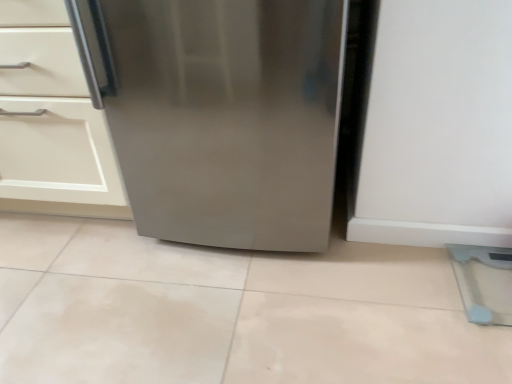
The height and width of the screenshot is (384, 512). What do you see at coordinates (52, 121) in the screenshot?
I see `matte white cabinet at left` at bounding box center [52, 121].

Locate an element on the screen. matte white cabinet at left is located at coordinates (52, 121).

What is the approximate height of stainless steel refrigerator at center?

28.58 inches.

Identify the location of stainless steel refrigerator at center. The image size is (512, 384). (221, 114).

Image resolution: width=512 pixels, height=384 pixels. What do you see at coordinates (221, 114) in the screenshot?
I see `stainless steel refrigerator at center` at bounding box center [221, 114].

The image size is (512, 384). Identify the location of matte white cabinet at left. (52, 121).

Does matte white cabinet at left appear on the right side of stainless steel refrigerator at center?

No, matte white cabinet at left is not to the right of stainless steel refrigerator at center.

Between matte white cabinet at left and stainless steel refrigerator at center, which one is positioned behind?

matte white cabinet at left is behind.

Is point (31, 39) behind point (189, 106)?

Yes.

From the image's perspective, would you say matte white cabinet at left is shown under stainless steel refrigerator at center?

Incorrect, from the image's perspective, matte white cabinet at left is higher than stainless steel refrigerator at center.

From a real-world perspective, is matte white cabinet at left positioned under stainless steel refrigerator at center based on gravity?

Yes, from a real-world perspective, matte white cabinet at left is below stainless steel refrigerator at center.

Looking at this image, is matte white cabinet at left wider than stainless steel refrigerator at center?

In fact, matte white cabinet at left might be narrower than stainless steel refrigerator at center.

From the picture: Considering the relative sizes of matte white cabinet at left and stainless steel refrigerator at center in the image provided, is matte white cabinet at left shorter than stainless steel refrigerator at center?

Yes, matte white cabinet at left is shorter than stainless steel refrigerator at center.

Between matte white cabinet at left and stainless steel refrigerator at center, which one has larger size?

matte white cabinet at left.

Is matte white cabinet at left inside or outside of stainless steel refrigerator at center?

matte white cabinet at left is outside stainless steel refrigerator at center.

Is the surface of matte white cabinet at left in direct contact with stainless steel refrigerator at center?

No.

Is matte white cabinet at left turned away from stainless steel refrigerator at center?

No, matte white cabinet at left's orientation is not away from stainless steel refrigerator at center.

Can you tell me how much matte white cabinet at left and stainless steel refrigerator at center differ in facing direction?

The facing directions of matte white cabinet at left and stainless steel refrigerator at center are 0.000102 degrees apart.

Measure the distance from matte white cabinet at left to stainless steel refrigerator at center.

matte white cabinet at left and stainless steel refrigerator at center are 15.30 inches apart from each other.

At what (x,y) coordinates should I click in order to perform the action: click on refrigerator located below the matte white cabinet at left (from the image's perspective). Please return your answer as a coordinate pair (x, y). Looking at the image, I should click on (221, 114).

Visually, is stainless steel refrigerator at center positioned to the left or to the right of matte white cabinet at left?

From the image, it's evident that stainless steel refrigerator at center is to the right of matte white cabinet at left.

Between stainless steel refrigerator at center and matte white cabinet at left, which one is positioned in front?

stainless steel refrigerator at center.

Between point (511, 240) and point (42, 25), which one is positioned in front?

The point (42, 25) is closer.

From the image's perspective, is stainless steel refrigerator at center positioned above or below matte white cabinet at left?

stainless steel refrigerator at center is situated lower than matte white cabinet at left in the image.

From a real-world perspective, is stainless steel refrigerator at center located higher than matte white cabinet at left?

Yes, from a real-world perspective, stainless steel refrigerator at center is over matte white cabinet at left

Is stainless steel refrigerator at center wider than matte white cabinet at left?

Yes, stainless steel refrigerator at center is wider than matte white cabinet at left.

Is stainless steel refrigerator at center shorter than matte white cabinet at left?

In fact, stainless steel refrigerator at center may be taller than matte white cabinet at left.

Who is bigger, stainless steel refrigerator at center or matte white cabinet at left?

matte white cabinet at left is bigger.

Would you say stainless steel refrigerator at center is inside or outside matte white cabinet at left?

stainless steel refrigerator at center is outside matte white cabinet at left.

Is the surface of stainless steel refrigerator at center in direct contact with matte white cabinet at left?

stainless steel refrigerator at center and matte white cabinet at left are not in contact.

Is stainless steel refrigerator at center aimed at matte white cabinet at left?

No, stainless steel refrigerator at center is not aimed at matte white cabinet at left.

What's the angular difference between stainless steel refrigerator at center and matte white cabinet at left's facing directions?

There is a 0.000102-degree angle between the facing directions of stainless steel refrigerator at center and matte white cabinet at left.

This screenshot has height=384, width=512. In order to click on refrigerator in front of the matte white cabinet at left in this screenshot , I will do `click(221, 114)`.

What are the coordinates of `cabinetry above the stainless steel refrigerator at center (from the image's perspective)` in the screenshot? It's located at (52, 121).

In order to click on cabinetry on the left side of stainless steel refrigerator at center in this screenshot , I will do `click(52, 121)`.